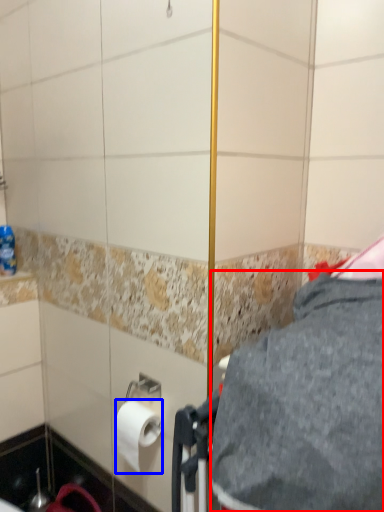
Question: Which object appears farthest to the camera in this image, gray (highlighted by a red box) or toilet paper (highlighted by a blue box)?

Choices:
 (A) gray
 (B) toilet paper

Answer: (B)